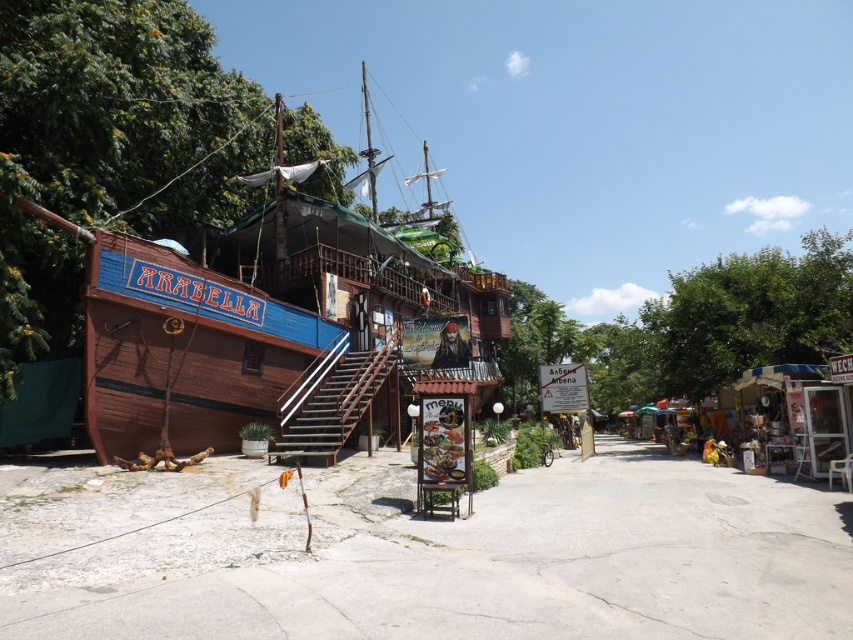
Question: Where is green leafy tree at left located in relation to metallic silver stall at right in the image?

Choices:
 (A) right
 (B) left

Answer: (B)

Question: Estimate the real-world distances between objects in this image. Which object is closer to the green leafy tree at left?

Choices:
 (A) green leafy tree at upper right
 (B) wooden pirate ship at center

Answer: (B)

Question: Can you confirm if wooden pirate ship at center is positioned to the left of green leafy tree at left?

Choices:
 (A) yes
 (B) no

Answer: (B)

Question: From the image, what is the correct spatial relationship of wooden pirate ship at center in relation to metallic silver stall at right?

Choices:
 (A) right
 (B) left

Answer: (B)

Question: Which point is farther from the camera taking this photo?

Choices:
 (A) (196, 244)
 (B) (51, 164)

Answer: (A)

Question: Which of the following is the closest to the observer?

Choices:
 (A) (778, 392)
 (B) (32, 26)
 (C) (167, 273)
 (D) (723, 316)

Answer: (B)